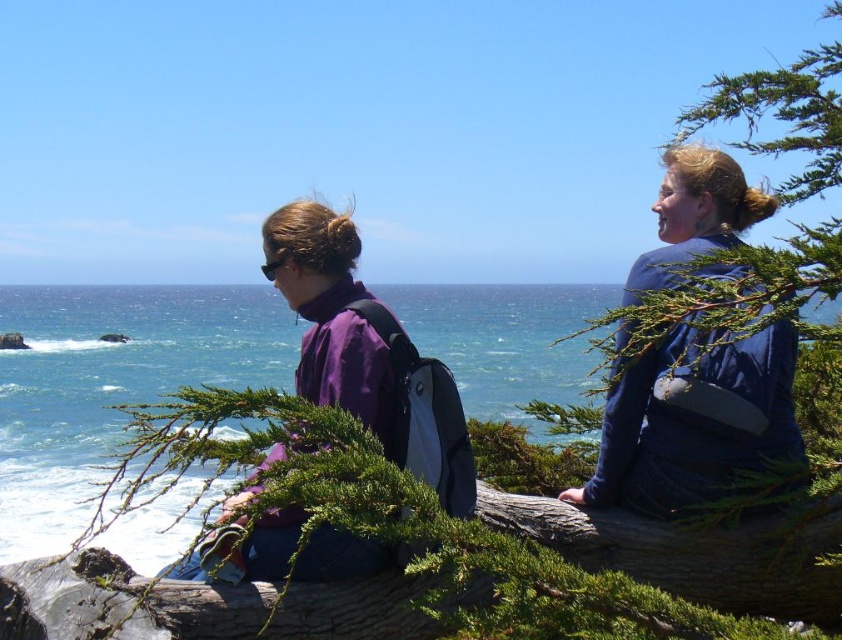
Question: Is blue water at center bigger than purple matte jacket at center?

Choices:
 (A) yes
 (B) no

Answer: (A)

Question: Which object is positioned closest to the purple matte jacket at center?

Choices:
 (A) blue fabric jacket at upper right
 (B) blue water at center

Answer: (A)

Question: Among these points, which one is nearest to the camera?

Choices:
 (A) (744, 422)
 (B) (345, 310)

Answer: (A)

Question: Which of the following is the farthest from the observer?

Choices:
 (A) purple matte jacket at center
 (B) blue water at center
 (C) blue fabric jacket at upper right

Answer: (B)

Question: Is blue water at center wider than purple matte jacket at center?

Choices:
 (A) yes
 (B) no

Answer: (A)

Question: Does blue fabric jacket at upper right have a smaller size compared to purple matte jacket at center?

Choices:
 (A) yes
 (B) no

Answer: (A)